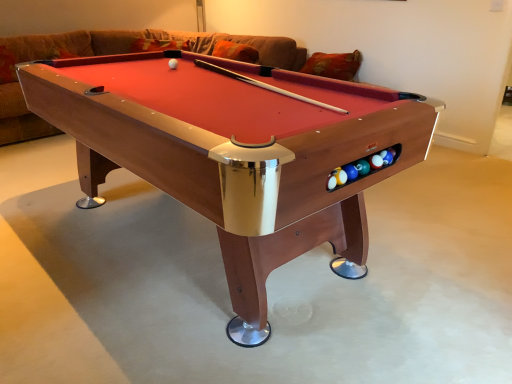
I want to click on wooden billiard table at center, so click(x=236, y=154).

This screenshot has height=384, width=512. What do you see at coordinates (109, 54) in the screenshot?
I see `brown fabric couch at upper center` at bounding box center [109, 54].

What is the approximate width of white matte ball at center?

white matte ball at center is 1.94 inches wide.

Locate an element on the screen. wooden billiard table at center is located at coordinates click(x=236, y=154).

Measure the distance from brown fabric couch at upper center to wooden billiard table at center.

brown fabric couch at upper center is 6.94 feet away from wooden billiard table at center.

From the image's perspective, between brown fabric couch at upper center and wooden billiard table at center, who is located below?

From the image's view, wooden billiard table at center is below.

Which is closer to the camera, [24,123] or [242,152]?

Positioned in front is point [242,152].

Which object is wider, white matte ball at center or wooden billiard table at center?

wooden billiard table at center.

Between point (172, 60) and point (204, 186), which one is positioned behind?

Point (172, 60)

From a real-world perspective, which is physically below, white matte ball at center or wooden billiard table at center?

wooden billiard table at center, from a real-world perspective.

Is white matte ball at center to the left of wooden billiard table at center from the viewer's perspective?

Yes.

Considering the sizes of objects wooden billiard table at center and brown fabric couch at upper center in the image provided, who is taller, wooden billiard table at center or brown fabric couch at upper center?

Standing taller between the two is wooden billiard table at center.

Is wooden billiard table at center far from brown fabric couch at upper center?

wooden billiard table at center is positioned a significant distance from brown fabric couch at upper center.

At what (x,y) coordinates should I click in order to perform the action: click on couch that appears below the wooden billiard table at center (from a real-world perspective). Please return your answer as a coordinate pair (x, y). Looking at the image, I should click on coord(109,54).

Is wooden billiard table at center inside or outside of brown fabric couch at upper center?

wooden billiard table at center cannot be found inside brown fabric couch at upper center.

From the picture: Can brown fabric couch at upper center be found inside white matte ball at center?

Actually, brown fabric couch at upper center is outside white matte ball at center.

Looking at this image, how different are the orientations of white matte ball at center and brown fabric couch at upper center in degrees?

77.1 degrees.

Does point (173, 69) lie in front of point (59, 46)?

That is True.

Based on the photo, in terms of width, does wooden billiard table at center look wider or thinner when compared to white matte ball at center?

Considering their sizes, wooden billiard table at center looks broader than white matte ball at center.

How different are the orientations of wooden billiard table at center and white matte ball at center in degrees?

wooden billiard table at center and white matte ball at center are facing 13.6 degrees away from each other.

How much distance is there between wooden billiard table at center and white matte ball at center?

34.99 inches.

Which is behind, point (37, 92) or point (176, 67)?

The point (176, 67) is behind.

Is brown fabric couch at upper center not inside white matte ball at center?

brown fabric couch at upper center is positioned outside white matte ball at center.

Is brown fabric couch at upper center behind white matte ball at center?

Yes, brown fabric couch at upper center is further from the viewer.

Between point (94, 48) and point (176, 62), which one is positioned in front?

Point (176, 62)

Locate an element on the screen. This screenshot has height=384, width=512. couch directly beneath the wooden billiard table at center (from a real-world perspective) is located at coordinates (109, 54).

You are a GUI agent. You are given a task and a screenshot of the screen. Output one action in this format:
    pyautogui.click(x=<x>, y=<y>)
    Task: Click on the billiard table that appears on the right of white matte ball at center
    
    Given the screenshot: What is the action you would take?
    pyautogui.click(x=236, y=154)

Estimate the real-world distances between objects in this image. Which object is further from white matte ball at center, brown fabric couch at upper center or wooden billiard table at center?

brown fabric couch at upper center lies further to white matte ball at center than the other object.

Looking at the image, which one is located further to brown fabric couch at upper center, wooden billiard table at center or white matte ball at center?

The object further to brown fabric couch at upper center is wooden billiard table at center.

Which object lies nearer to the anchor point brown fabric couch at upper center, white matte ball at center or wooden billiard table at center?

Among the two, white matte ball at center is located nearer to brown fabric couch at upper center.

Considering their positions, is wooden billiard table at center positioned closer to white matte ball at center than brown fabric couch at upper center?

wooden billiard table at center is closer to white matte ball at center.

Based on their spatial positions, is brown fabric couch at upper center or white matte ball at center closer to wooden billiard table at center?

Based on the image, white matte ball at center appears to be nearer to wooden billiard table at center.

From the picture: Considering their positions, is white matte ball at center positioned further to wooden billiard table at center than brown fabric couch at upper center?

brown fabric couch at upper center is positioned further to the anchor wooden billiard table at center.

Where is `ball between wooden billiard table at center and brown fabric couch at upper center from front to back`? ball between wooden billiard table at center and brown fabric couch at upper center from front to back is located at coordinates (173, 64).